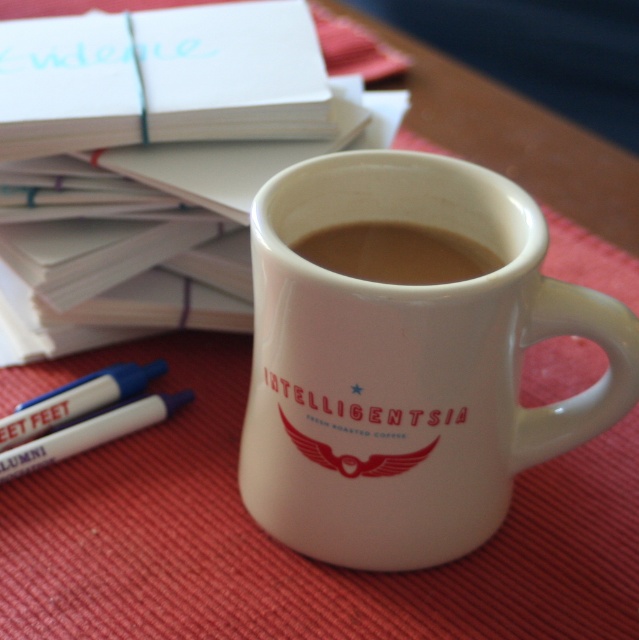
You are a photographer trying to capture the white glossy mug at center in focus. The camera you are using has a depth of field that can only sharply focus objects within 25 inches. Based on the scene description, will the mug be in focus?

The white glossy mug at center is 28.94 inches from the camera, which is beyond the 25 inch depth of field range. Therefore, the mug will not be in focus.

You are a barista trying to clean the workspace. You need to move the white glossy mug at center and the brown matte coffee at center to the sink, which is behind you. Which object should you move first to avoid spilling the coffee?

You should move the brown matte coffee at center first because the white glossy mug at center is closer to you, so moving the coffee first would prevent it from spilling when reaching for the mug.